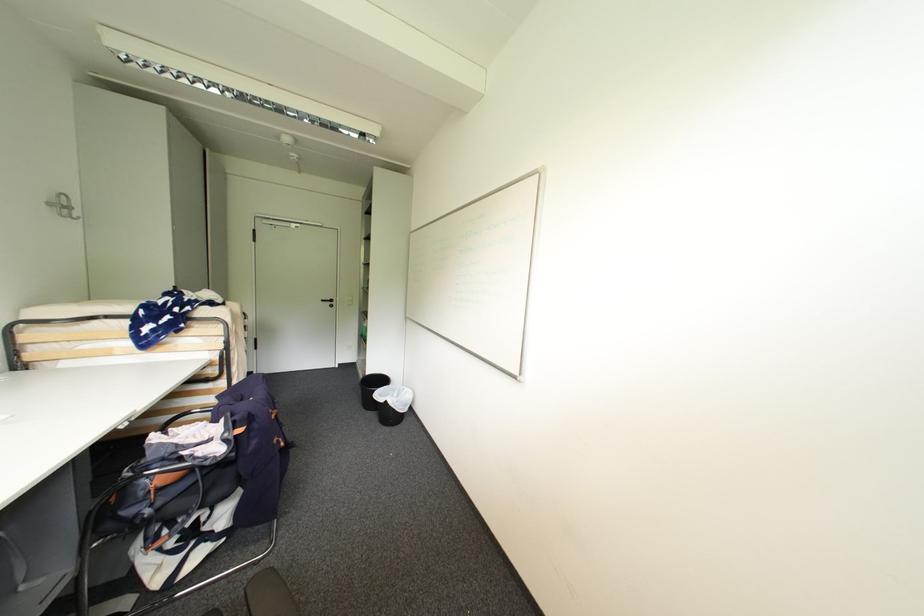
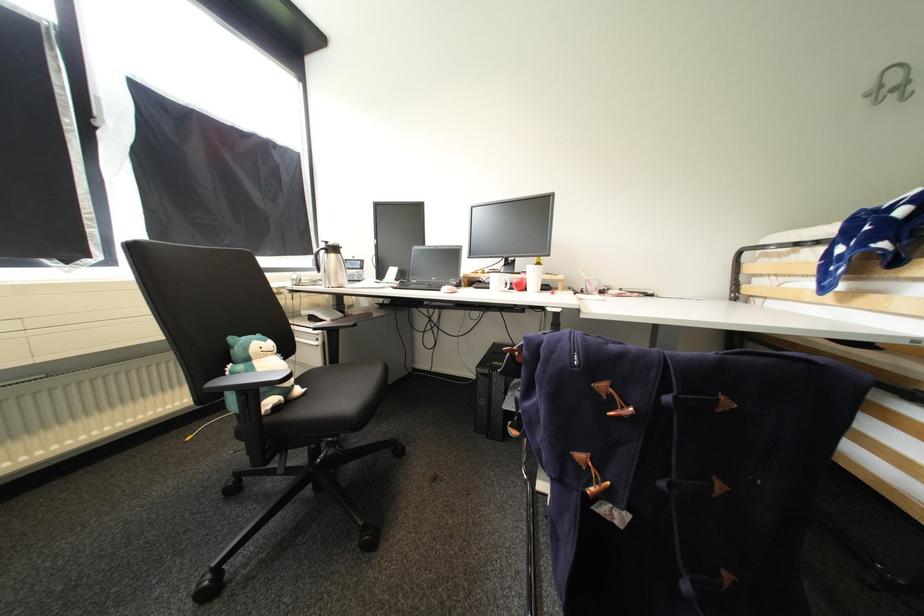
Find the pixel in the second image that matches (x=75, y=209) in the first image.

(912, 84)